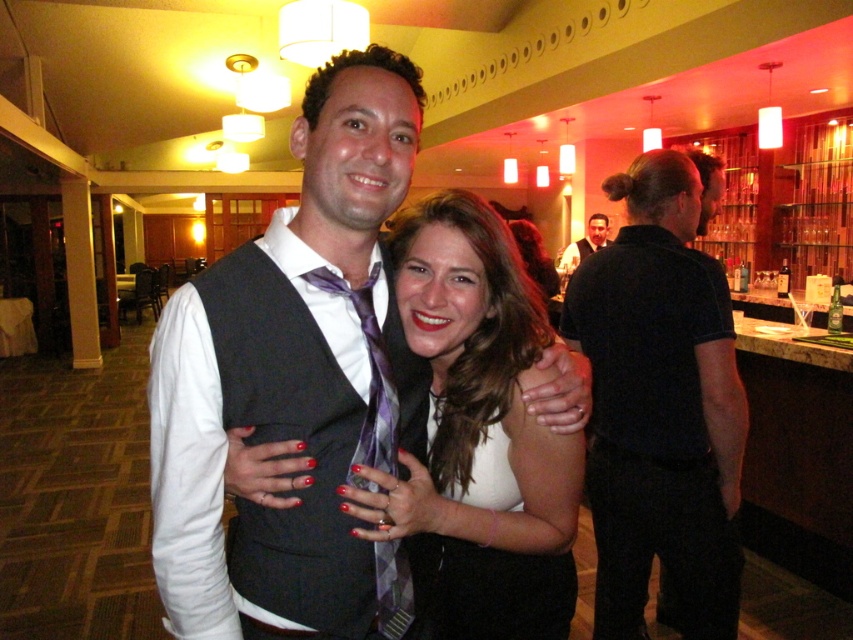
Can you confirm if black smooth shirt at right is thinner than dark gray vest at center?

Yes.

Which is in front, point (631, 243) or point (569, 273)?

Positioned in front is point (631, 243).

The width and height of the screenshot is (853, 640). What are the coordinates of `black smooth shirt at right` in the screenshot? It's located at click(x=660, y=406).

Who is shorter, white matte dress at center or dark gray vest at center?

Standing shorter between the two is white matte dress at center.

Who is positioned more to the right, white matte dress at center or dark gray vest at center?

dark gray vest at center is more to the right.

Identify the location of white matte dress at center. Image resolution: width=853 pixels, height=640 pixels. (496, 589).

Is matte black vest at center closer to camera compared to dark gray vest at center?

Yes, it is in front of dark gray vest at center.

Is matte black vest at center bigger than dark gray vest at center?

Incorrect, matte black vest at center is not larger than dark gray vest at center.

The width and height of the screenshot is (853, 640). What do you see at coordinates (291, 376) in the screenshot? I see `matte black vest at center` at bounding box center [291, 376].

The height and width of the screenshot is (640, 853). Identify the location of matte black vest at center. (291, 376).